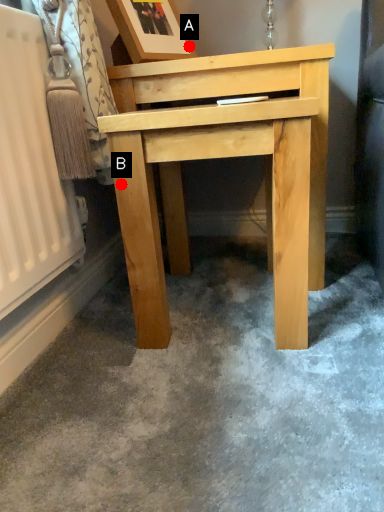
Question: Two points are circled on the image, labeled by A and B beside each circle. Which point is further to the camera?

Choices:
 (A) A is further
 (B) B is further

Answer: (A)